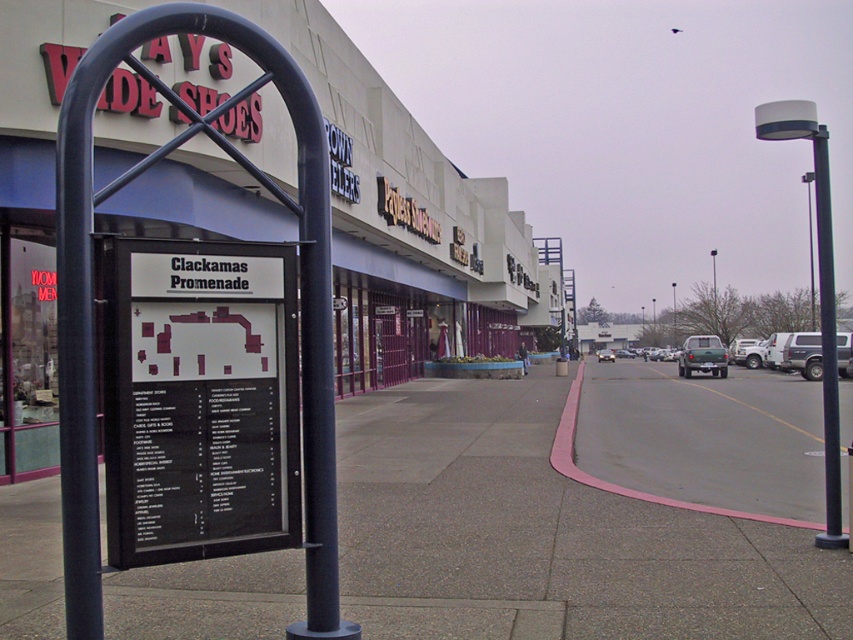
Question: In this image, where is gray asphalt pavement at lower right located relative to black metal pole at right?

Choices:
 (A) above
 (B) below

Answer: (B)

Question: Is concrete sidewalk at center to the left of black plastic sign at center from the viewer's perspective?

Choices:
 (A) no
 (B) yes

Answer: (A)

Question: Which point appears closest to the camera in this image?

Choices:
 (A) (598, 356)
 (B) (685, 348)

Answer: (B)

Question: Which object is positioned closest to the concrete sidewalk at center?

Choices:
 (A) black metal pole at right
 (B) silver metallic suv at right
 (C) green matte truck at center-right

Answer: (A)

Question: Does concrete sidewalk at center lie in front of silver metallic suv at right?

Choices:
 (A) no
 (B) yes

Answer: (B)

Question: Which point is farther from the camera taking this photo?

Choices:
 (A) (515, 397)
 (B) (845, 333)

Answer: (B)